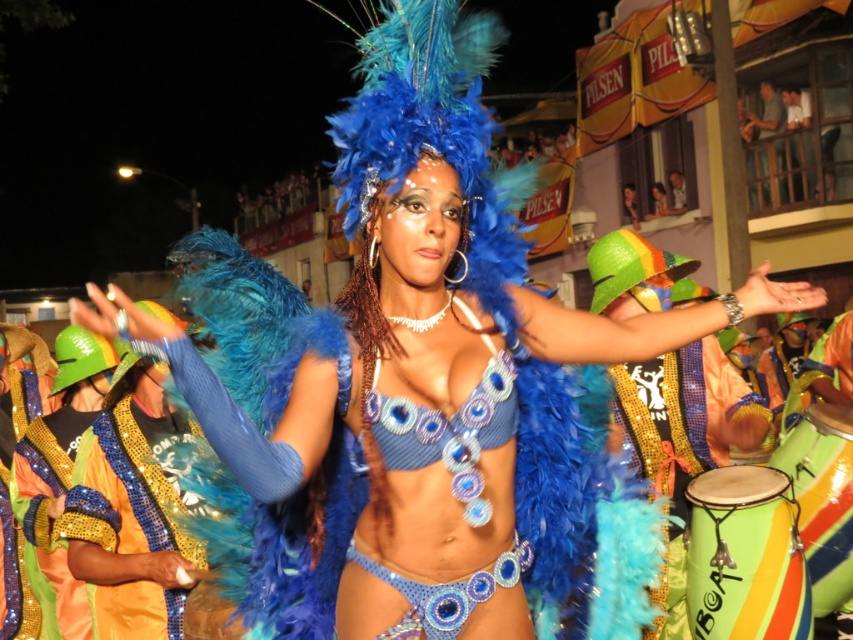
Between green painted wood drum at lower right and green striped drum at lower right, which one has more height?

With more height is green striped drum at lower right.

Does green painted wood drum at lower right have a lesser width compared to green striped drum at lower right?

Yes.

Image resolution: width=853 pixels, height=640 pixels. What are the coordinates of `green painted wood drum at lower right` in the screenshot? It's located at (746, 556).

Does point (102, 609) lie in front of point (837, 586)?

Yes, point (102, 609) is in front of point (837, 586).

Is point (169, 456) positioned in front of point (827, 448)?

Yes, point (169, 456) is in front of point (827, 448).

Find the location of a particular element. This screenshot has width=853, height=640. shiny gold sequins at center is located at coordinates (131, 518).

Does shiny gold sequins at center lie behind green painted wood drum at lower right?

Yes.

Between point (111, 596) and point (780, 605), which one is positioned behind?

Point (111, 596)

This screenshot has width=853, height=640. What do you see at coordinates (131, 518) in the screenshot?
I see `shiny gold sequins at center` at bounding box center [131, 518].

Find the location of a particular element. The image size is (853, 640). shiny gold sequins at center is located at coordinates (131, 518).